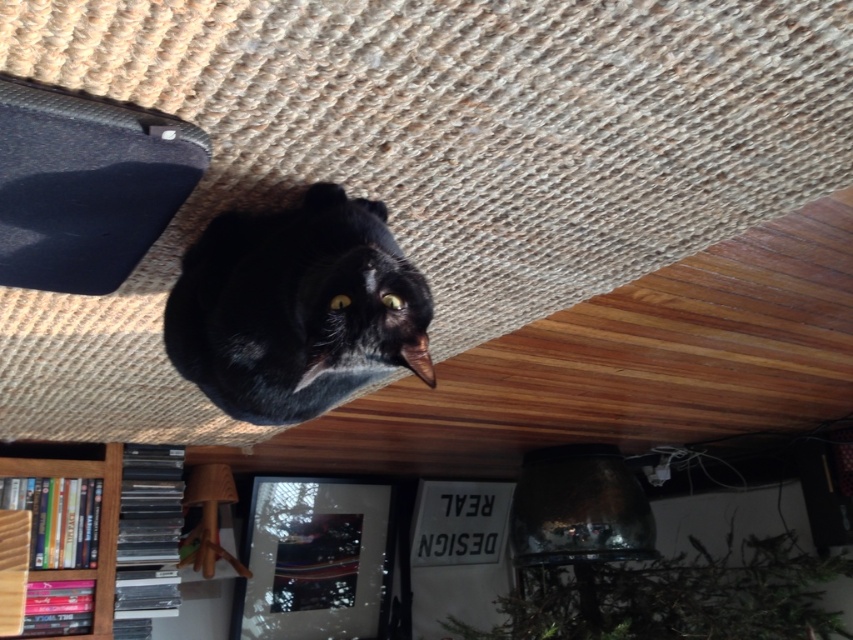
Which is above, black matte cat at center or wooden bookshelf at lower left?

Positioned higher is black matte cat at center.

Can you confirm if black matte cat at center is positioned to the right of wooden bookshelf at lower left?

Yes, black matte cat at center is to the right of wooden bookshelf at lower left.

Is point (426, 352) less distant than point (114, 502)?

Yes.

At what (x,y) coordinates should I click in order to perform the action: click on black matte cat at center. Please return your answer as a coordinate pair (x, y). Image resolution: width=853 pixels, height=640 pixels. Looking at the image, I should click on (296, 307).